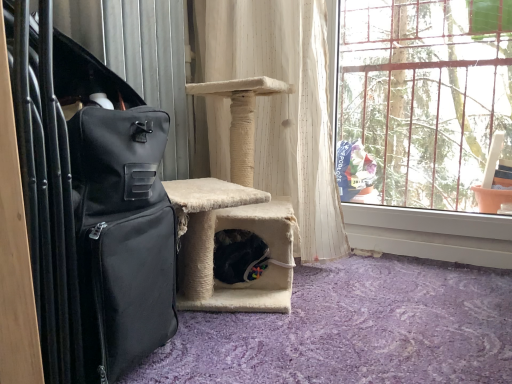
In order to face white textured curtain at center, should I rotate leftwards or rightwards?

You should look right and rotate roughly 1.192 degrees.

The image size is (512, 384). Find the location of `black fabric suitcase at left`. black fabric suitcase at left is located at coordinates (91, 207).

What do you see at coordinates (91, 207) in the screenshot? I see `black fabric suitcase at left` at bounding box center [91, 207].

This screenshot has height=384, width=512. Identify the location of white textured curtain at center. (283, 105).

Choose the correct answer: Is white textured curtain at center inside clear glass window at upper right or outside it?

Answer: white textured curtain at center is not inside clear glass window at upper right, it's outside.

Identify the location of curtain on the left of the clear glass window at upper right. (283, 105).

From the picture: Considering the positions of objects white textured curtain at center and clear glass window at upper right in the image provided, who is in front, white textured curtain at center or clear glass window at upper right?

clear glass window at upper right is in front.

Which is behind, point (336, 188) or point (408, 54)?

Point (408, 54)

This screenshot has width=512, height=384. I want to click on window lying above the black fabric suitcase at left (from the image's perspective), so click(426, 101).

Considering the relative positions of black fabric suitcase at left and clear glass window at upper right in the image provided, is black fabric suitcase at left behind clear glass window at upper right?

No, black fabric suitcase at left is closer to the viewer.

Can you confirm if black fabric suitcase at left is wider than clear glass window at upper right?

Yes.

Is clear glass window at upper right thinner than white textured curtain at center?

Indeed, clear glass window at upper right has a lesser width compared to white textured curtain at center.

How distant is clear glass window at upper right from white textured curtain at center?

They are 16.30 inches apart.

What's the angular difference between clear glass window at upper right and white textured curtain at center's facing directions?

They differ by 0.348 degrees in their facing directions.

Is clear glass window at upper right touching white textured curtain at center?

No.

Measure the distance from clear glass window at upper right to black fabric suitcase at left.

clear glass window at upper right and black fabric suitcase at left are 3.60 feet apart from each other.

Does clear glass window at upper right have a greater height compared to black fabric suitcase at left?

Correct, clear glass window at upper right is much taller as black fabric suitcase at left.

Is clear glass window at upper right aimed at black fabric suitcase at left?

Yes, clear glass window at upper right is aimed at black fabric suitcase at left.

Is clear glass window at upper right placed right next to black fabric suitcase at left?

clear glass window at upper right and black fabric suitcase at left are clearly separated.

The image size is (512, 384). In order to click on curtain that appears behind the black fabric suitcase at left in this screenshot , I will do `click(283, 105)`.

Is black fabric suitcase at left far from white textured curtain at center?

No, black fabric suitcase at left is not far away from white textured curtain at center.

Can you confirm if black fabric suitcase at left is positioned to the left of white textured curtain at center?

Yes.

Image resolution: width=512 pixels, height=384 pixels. I want to click on curtain behind the black fabric suitcase at left, so click(283, 105).

Could you tell me if white textured curtain at center is turned towards black fabric suitcase at left?

Yes, white textured curtain at center is oriented towards black fabric suitcase at left.

I want to click on window in front of the white textured curtain at center, so click(x=426, y=101).

In order to click on window that is on the right side of black fabric suitcase at left in this screenshot , I will do `click(426, 101)`.

Looking at the image, which one is located closer to black fabric suitcase at left, white textured curtain at center or clear glass window at upper right?

white textured curtain at center is closer to black fabric suitcase at left.

Based on their spatial positions, is clear glass window at upper right or white textured curtain at center further from black fabric suitcase at left?

clear glass window at upper right is positioned further to the anchor black fabric suitcase at left.

Based on their spatial positions, is clear glass window at upper right or black fabric suitcase at left closer to white textured curtain at center?

Based on the image, clear glass window at upper right appears to be nearer to white textured curtain at center.

Looking at the image, which one is located further to white textured curtain at center, black fabric suitcase at left or clear glass window at upper right?

Among the two, black fabric suitcase at left is located further to white textured curtain at center.

Considering their positions, is white textured curtain at center positioned closer to clear glass window at upper right than black fabric suitcase at left?

Among the two, white textured curtain at center is located nearer to clear glass window at upper right.

Based on their spatial positions, is black fabric suitcase at left or white textured curtain at center closer to clear glass window at upper right?

white textured curtain at center is positioned closer to the anchor clear glass window at upper right.

The width and height of the screenshot is (512, 384). What are the coordinates of `curtain between black fabric suitcase at left and clear glass window at upper right from left to right` in the screenshot? It's located at (283, 105).